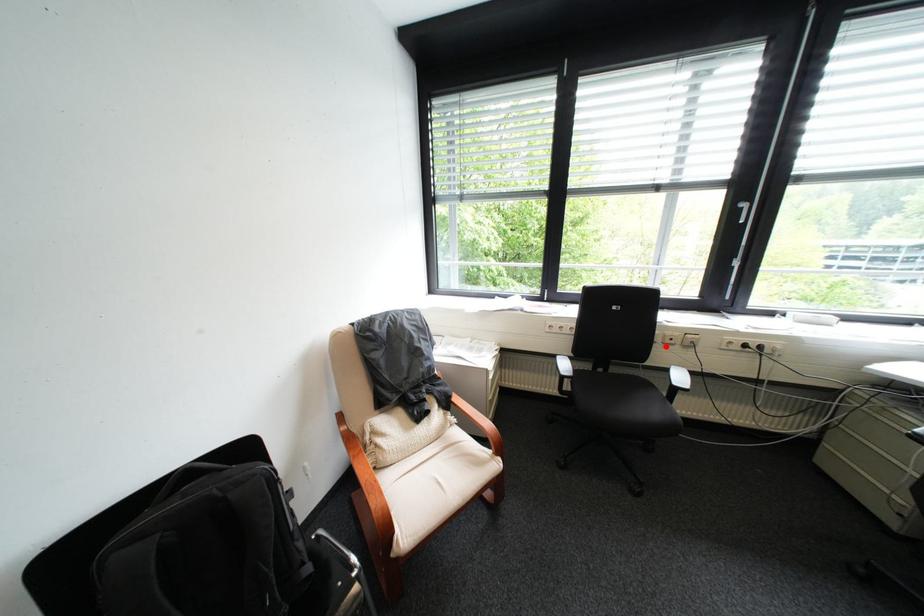
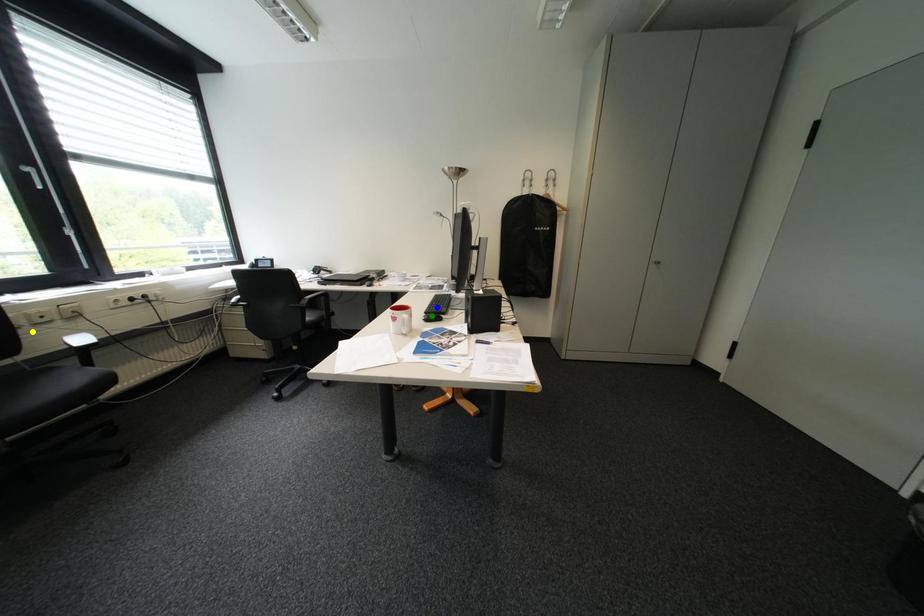
Question: I am providing you with two images of the same scene from different viewpoints. A red point is marked on the first image. You are given multiple points on the second image. In image 2, which mark is for the same physical point as the one in image 1?

Choices:
 (A) green point
 (B) yellow point
 (C) blue point

Answer: (B)